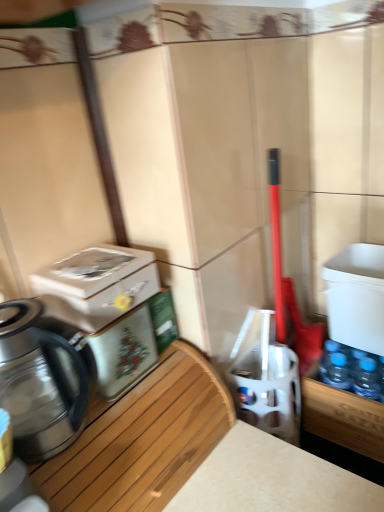
Measure the distance between point (343, 295) and camera.

Point (343, 295) is 1.03 meters away from camera.

The height and width of the screenshot is (512, 384). Find the location of `woodenmaterial/texture at left`. woodenmaterial/texture at left is located at coordinates pyautogui.click(x=143, y=440).

Can you confirm if shiny metallic kettle at left is taller than metallic silver water cooler at left, the 3th water cooler from the right?

Yes, shiny metallic kettle at left is taller than metallic silver water cooler at left, the 3th water cooler from the right.

Looking at this image, is shiny metallic kettle at left oriented away from metallic silver water cooler at left, the 1th water cooler from the left?

No.

Can you tell me how much shiny metallic kettle at left and metallic silver water cooler at left, the 1th water cooler from the left, differ in facing direction?

They differ by 0.000133 degrees in their facing directions.

Does white plastic water cooler at right, acting as the 3th water cooler starting from the left, turn towards white glossy water cooler at center, which is the 2th water cooler from right to left?

No.

Is white plastic water cooler at right, acting as the 3th water cooler starting from the left, taller or shorter than white glossy water cooler at center, placed as the 2th water cooler when sorted from left to right?

In the image, white plastic water cooler at right, acting as the 3th water cooler starting from the left, appears to be taller than white glossy water cooler at center, placed as the 2th water cooler when sorted from left to right.

Would you say white plastic water cooler at right, acting as the 3th water cooler starting from the left, is inside or outside white glossy water cooler at center, which is the 2th water cooler from right to left?

white plastic water cooler at right, acting as the 3th water cooler starting from the left, is outside white glossy water cooler at center, which is the 2th water cooler from right to left.

Which is behind, point (352, 341) or point (264, 362)?

The point (352, 341) is more distant.

Can you confirm if metallic silver water cooler at left, the 1th water cooler from the left, is thinner than woodenmaterial/texture at left?

Yes, metallic silver water cooler at left, the 1th water cooler from the left, is thinner than woodenmaterial/texture at left.

From the image's perspective, is metallic silver water cooler at left, the 1th water cooler from the left, located above or below woodenmaterial/texture at left?

Clearly, from the image's perspective, metallic silver water cooler at left, the 1th water cooler from the left, is above woodenmaterial/texture at left.

Considering the positions of point (137, 295) and point (156, 442), is point (137, 295) closer or farther from the camera than point (156, 442)?

Point (137, 295) is positioned farther from the camera compared to point (156, 442).

Can you see metallic silver water cooler at left, the 3th water cooler from the right, touching woodenmaterial/texture at left?

metallic silver water cooler at left, the 3th water cooler from the right, and woodenmaterial/texture at left are not in contact.

Is woodenmaterial/texture at left wider or thinner than white glossy water cooler at center, placed as the 2th water cooler when sorted from left to right?

woodenmaterial/texture at left is wider than white glossy water cooler at center, placed as the 2th water cooler when sorted from left to right.

From the image's perspective, which object appears higher, woodenmaterial/texture at left or white glossy water cooler at center, placed as the 2th water cooler when sorted from left to right?

white glossy water cooler at center, placed as the 2th water cooler when sorted from left to right, appears higher in the image.

Is white glossy water cooler at center, placed as the 2th water cooler when sorted from left to right, at the back of woodenmaterial/texture at left?

No.

Where is `the 1st water cooler above the woodenmaterial/texture at left (from the image's perspective)`? the 1st water cooler above the woodenmaterial/texture at left (from the image's perspective) is located at coordinates (267, 383).

In the image, is white glossy water cooler at center, which is the 2th water cooler from right to left, on the left side or the right side of metallic silver water cooler at left, the 3th water cooler from the right?

Clearly, white glossy water cooler at center, which is the 2th water cooler from right to left, is on the right of metallic silver water cooler at left, the 3th water cooler from the right, in the image.

From a real-world perspective, does white glossy water cooler at center, placed as the 2th water cooler when sorted from left to right, stand above metallic silver water cooler at left, the 1th water cooler from the left?

Actually, white glossy water cooler at center, placed as the 2th water cooler when sorted from left to right, is physically below metallic silver water cooler at left, the 1th water cooler from the left, in the real world.

Considering the sizes of objects white glossy water cooler at center, which is the 2th water cooler from right to left, and metallic silver water cooler at left, the 1th water cooler from the left, in the image provided, who is shorter, white glossy water cooler at center, which is the 2th water cooler from right to left, or metallic silver water cooler at left, the 1th water cooler from the left,?

With less height is metallic silver water cooler at left, the 1th water cooler from the left.

Is metallic silver water cooler at left, the 3th water cooler from the right, inside white glossy water cooler at center, placed as the 2th water cooler when sorted from left to right?

No, metallic silver water cooler at left, the 3th water cooler from the right, is located outside of white glossy water cooler at center, placed as the 2th water cooler when sorted from left to right.

From the image's perspective, between metallic silver water cooler at left, the 1th water cooler from the left, and shiny metallic kettle at left, who is located below?

shiny metallic kettle at left, from the image's perspective.

Between metallic silver water cooler at left, the 3th water cooler from the right, and shiny metallic kettle at left, which one has less height?

Standing shorter between the two is metallic silver water cooler at left, the 3th water cooler from the right.

Can you tell me how much metallic silver water cooler at left, the 1th water cooler from the left, and shiny metallic kettle at left differ in facing direction?

0.000133 degrees separate the facing orientations of metallic silver water cooler at left, the 1th water cooler from the left, and shiny metallic kettle at left.

Can you confirm if metallic silver water cooler at left, the 1th water cooler from the left, is positioned to the right of shiny metallic kettle at left?

Indeed, metallic silver water cooler at left, the 1th water cooler from the left, is positioned on the right side of shiny metallic kettle at left.

Is white glossy water cooler at center, which is the 2th water cooler from right to left, aimed at shiny metallic kettle at left?

No.

Which of these two, white glossy water cooler at center, placed as the 2th water cooler when sorted from left to right, or shiny metallic kettle at left, is bigger?

shiny metallic kettle at left.

Can you confirm if white glossy water cooler at center, which is the 2th water cooler from right to left, is positioned to the right of shiny metallic kettle at left?

Correct, you'll find white glossy water cooler at center, which is the 2th water cooler from right to left, to the right of shiny metallic kettle at left.

Locate an element on the screen. Image resolution: width=384 pixels, height=512 pixels. kettle above the metallic silver water cooler at left, the 3th water cooler from the right (from a real-world perspective) is located at coordinates (43, 379).

From the image's perspective, count 2nd water coolers upward from the white glossy water cooler at center, which is the 2th water cooler from right to left, and point to it. Please provide its 2D coordinates.

[(356, 297)]

From the picture: Based on their spatial positions, is shiny metallic kettle at left or metallic silver water cooler at left, the 1th water cooler from the left, further from woodenmaterial/texture at left?

metallic silver water cooler at left, the 1th water cooler from the left.

Which object lies further to the anchor point white plastic water cooler at right, the first water cooler positioned from the right, shiny metallic kettle at left or woodenmaterial/texture at left?

shiny metallic kettle at left lies further to white plastic water cooler at right, the first water cooler positioned from the right, than the other object.

From the image, which object appears to be farther from white glossy water cooler at center, placed as the 2th water cooler when sorted from left to right, metallic silver water cooler at left, the 3th water cooler from the right, or white plastic water cooler at right, the first water cooler positioned from the right?

metallic silver water cooler at left, the 3th water cooler from the right.

Looking at the image, which one is located further to white plastic water cooler at right, the first water cooler positioned from the right, metallic silver water cooler at left, the 3th water cooler from the right, or white glossy water cooler at center, which is the 2th water cooler from right to left?

Based on the image, metallic silver water cooler at left, the 3th water cooler from the right, appears to be further to white plastic water cooler at right, the first water cooler positioned from the right.

Estimate the real-world distances between objects in this image. Which object is further from metallic silver water cooler at left, the 1th water cooler from the left, white plastic water cooler at right, the first water cooler positioned from the right, or white glossy water cooler at center, placed as the 2th water cooler when sorted from left to right?

white plastic water cooler at right, the first water cooler positioned from the right, is further to metallic silver water cooler at left, the 1th water cooler from the left.

Looking at the image, which one is located closer to woodenmaterial/texture at left, metallic silver water cooler at left, the 3th water cooler from the right, or shiny metallic kettle at left?

shiny metallic kettle at left is positioned closer to the anchor woodenmaterial/texture at left.

From the image, which object appears to be farther from woodenmaterial/texture at left, white glossy water cooler at center, which is the 2th water cooler from right to left, or white plastic water cooler at right, the first water cooler positioned from the right?

white plastic water cooler at right, the first water cooler positioned from the right.

Considering their positions, is shiny metallic kettle at left positioned further to white glossy water cooler at center, which is the 2th water cooler from right to left, than white plastic water cooler at right, the first water cooler positioned from the right?

shiny metallic kettle at left is positioned further to the anchor white glossy water cooler at center, which is the 2th water cooler from right to left.

Find the location of a particular element. Image resolution: width=384 pixels, height=512 pixels. water cooler between shiny metallic kettle at left and white glossy water cooler at center, which is the 2th water cooler from right to left, from left to right is located at coordinates (106, 308).

I want to click on wood between metallic silver water cooler at left, the 1th water cooler from the left, and white glossy water cooler at center, which is the 2th water cooler from right to left, in the horizontal direction, so click(x=143, y=440).

This screenshot has height=512, width=384. I want to click on wood between shiny metallic kettle at left and white glossy water cooler at center, placed as the 2th water cooler when sorted from left to right, so point(143,440).

You are a GUI agent. You are given a task and a screenshot of the screen. Output one action in this format:
    pyautogui.click(x=<x>, y=<y>)
    Task: Click on the wood between shiny metallic kettle at left and white plastic water cooler at right, the first water cooler positioned from the right, from left to right
    Image resolution: width=384 pixels, height=512 pixels.
    Given the screenshot: What is the action you would take?
    pyautogui.click(x=143, y=440)